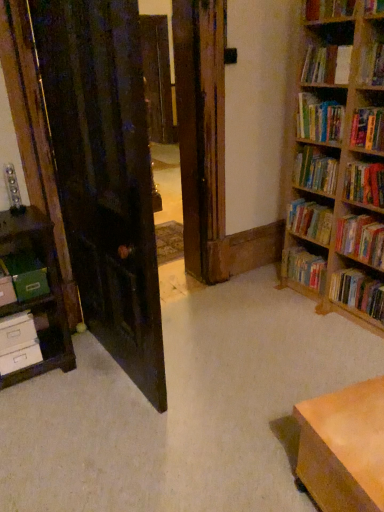
Locate an element on the screen. The height and width of the screenshot is (512, 384). vacant area on top of green matte paper at left (from a real-world perspective) is located at coordinates (19, 261).